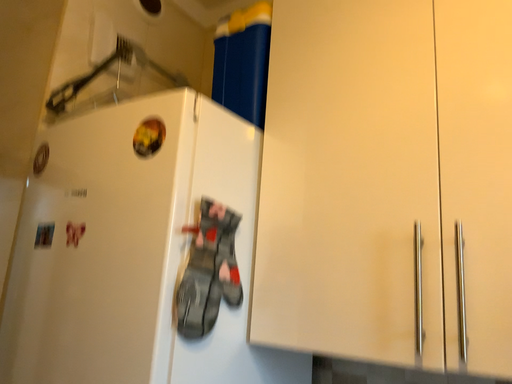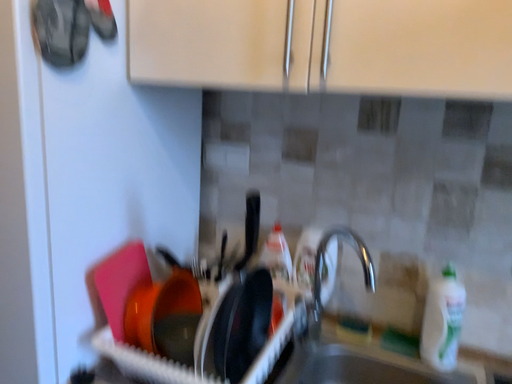
Question: How did the camera likely rotate when shooting the video?

Choices:
 (A) rotated right
 (B) rotated left

Answer: (A)